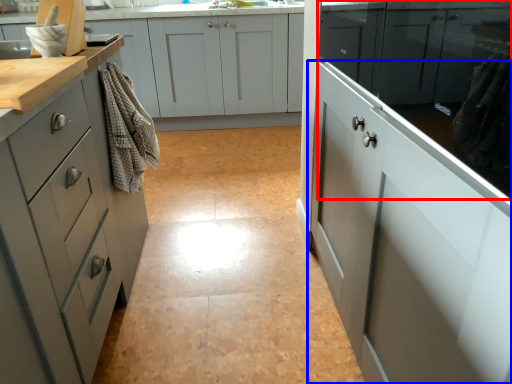
Question: Which of the following is the closest to the observer, cabinetry (highlighted by a red box) or cabinetry (highlighted by a blue box)?

Choices:
 (A) cabinetry
 (B) cabinetry

Answer: (A)